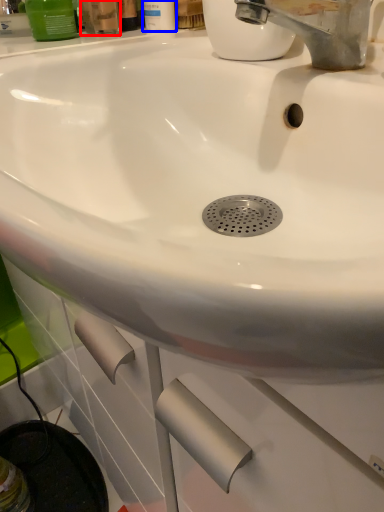
Question: Among these objects, which one is farthest to the camera, mouthwash (highlighted by a red box) or mouthwash (highlighted by a blue box)?

Choices:
 (A) mouthwash
 (B) mouthwash

Answer: (B)